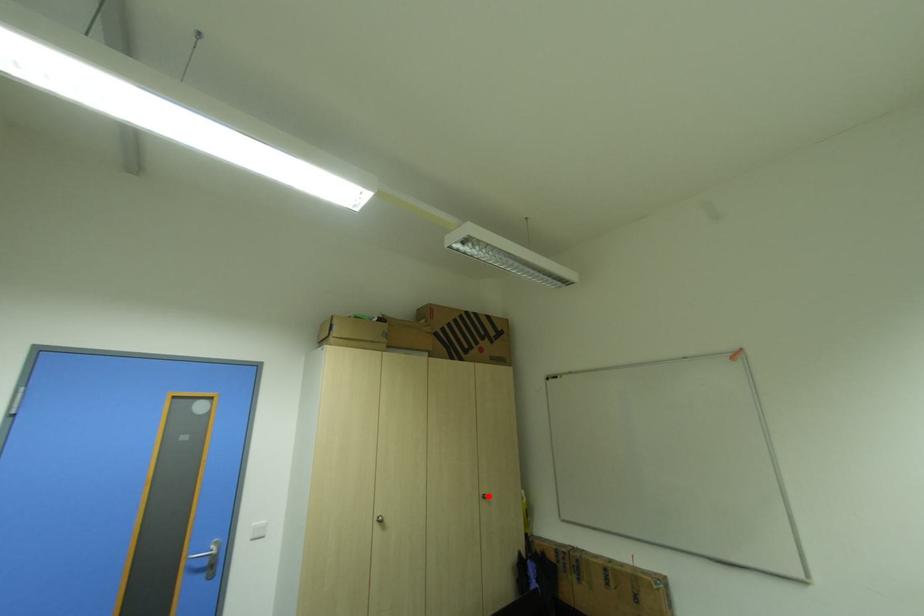
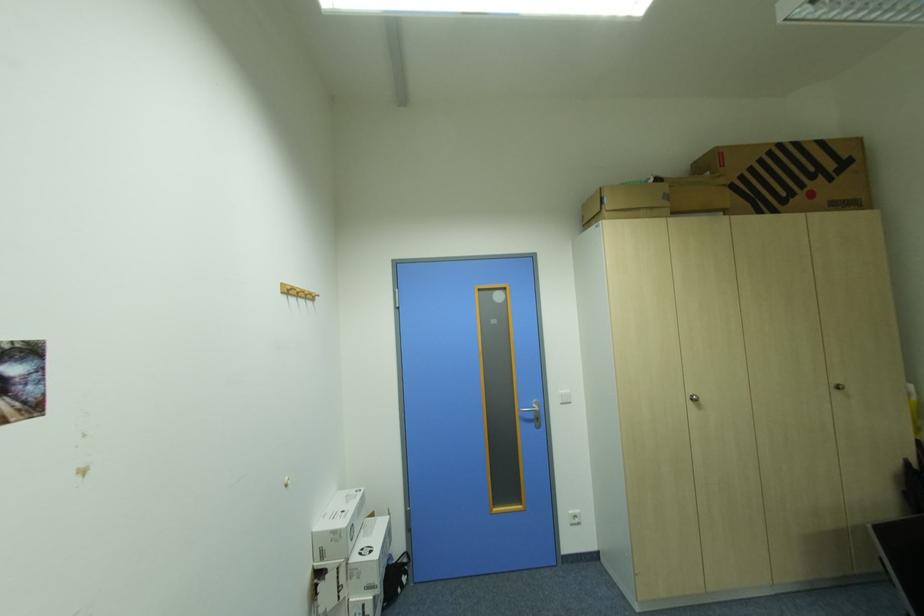
Question: I am providing you with two images of the same scene from different viewpoints. A red point is shown in image1. For the corresponding object point in image2, is it positioned nearer or farther from the camera?

Choices:
 (A) Nearer
 (B) Farther

Answer: (A)